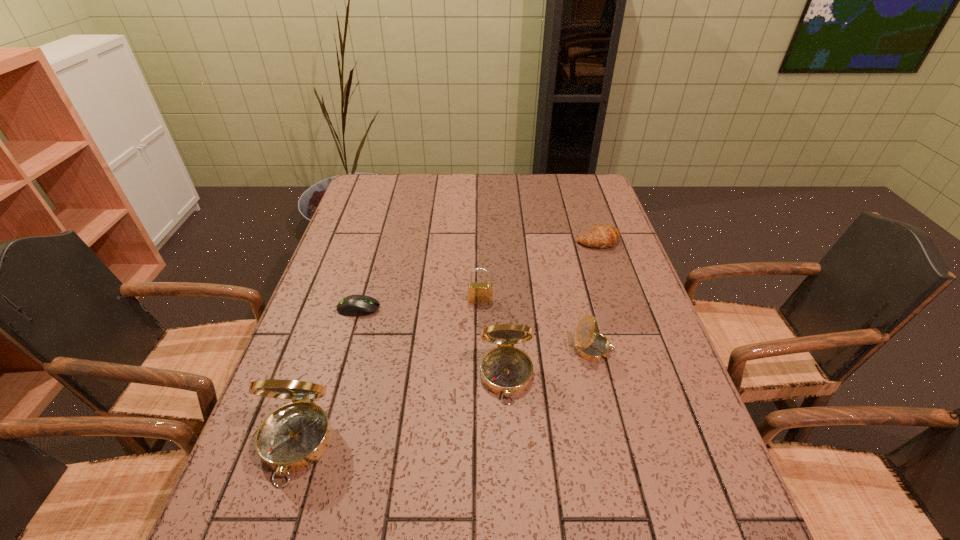
Identify the location of blank space located on the left of the farthest object. This screenshot has height=540, width=960. (518, 241).

Locate an element on the screen. This screenshot has width=960, height=540. vacant region located 0.180m on the wheel side of the computer mouse is located at coordinates (448, 308).

Image resolution: width=960 pixels, height=540 pixels. In order to click on vacant space positioned on the front-facing side of the padlock in this screenshot , I will do `click(481, 359)`.

Where is `object that is at the near edge`? object that is at the near edge is located at coordinates (294, 436).

This screenshot has width=960, height=540. I want to click on compass at the left edge, so click(x=294, y=436).

Identify the location of computer mouse present at the left edge. The width and height of the screenshot is (960, 540). (354, 305).

Find the location of a particular element. The height and width of the screenshot is (540, 960). compass that is at the right edge is located at coordinates (590, 345).

Locate an element on the screen. Image resolution: width=960 pixels, height=540 pixels. crescent roll located in the right edge section of the desktop is located at coordinates (601, 236).

Identify the location of object located in the near left corner section of the desktop. Image resolution: width=960 pixels, height=540 pixels. (294, 436).

You are a GUI agent. You are given a task and a screenshot of the screen. Output one action in this format:
    pyautogui.click(x=<x>, y=<y>)
    Task: Click on the vacant space at the far edge of the desktop
    The height and width of the screenshot is (540, 960).
    Given the screenshot: What is the action you would take?
    pyautogui.click(x=532, y=179)